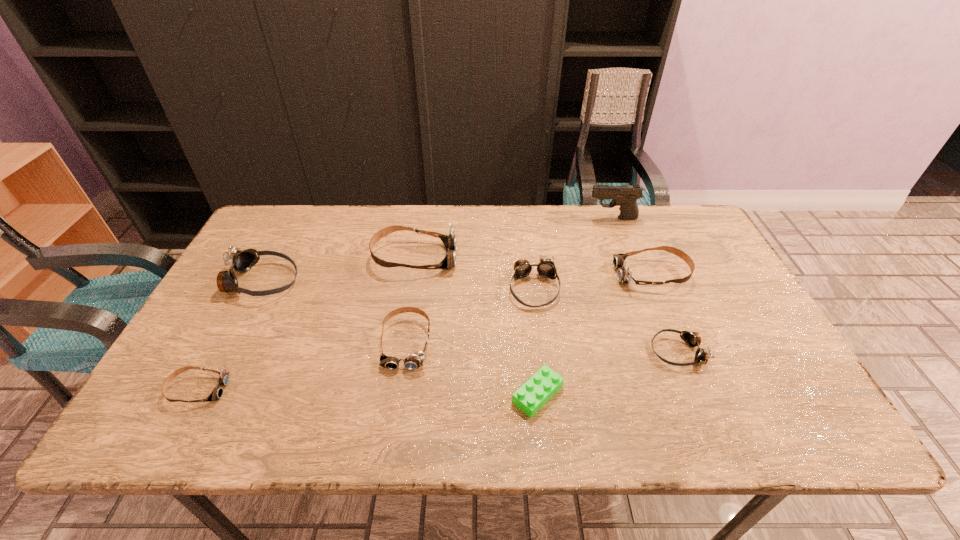
Where is `unoccupied area between the second smallest bronze goggles and the rightmost bronze goggles`? This screenshot has width=960, height=540. unoccupied area between the second smallest bronze goggles and the rightmost bronze goggles is located at coordinates (606, 320).

Image resolution: width=960 pixels, height=540 pixels. I want to click on unoccupied area between the nearest bronze goggles and the leftmost brown goggles, so click(438, 370).

Find the location of a particular element. The image size is (960, 540). free space that is in between the rightmost brown goggles and the smallest bronze goggles is located at coordinates (664, 313).

The height and width of the screenshot is (540, 960). I want to click on free spot between the green Lego and the nearest bronze goggles, so click(608, 373).

Where is `empty space that is in between the farthest object and the rightmost brown goggles`? empty space that is in between the farthest object and the rightmost brown goggles is located at coordinates (633, 246).

You are a GUI agent. You are given a task and a screenshot of the screen. Output one action in this format:
    pyautogui.click(x=<x>, y=<y>)
    Task: Click on the vacant area between the rightmost bronze goggles and the nearest brown goggles
    
    Given the screenshot: What is the action you would take?
    pyautogui.click(x=438, y=370)

Locate an element on the screen. vacant space that is in between the nearest brown goggles and the second nearest brown goggles is located at coordinates (302, 366).

Where is `free spot between the leftmost bronze goggles and the smallest brown goggles`? This screenshot has height=540, width=960. free spot between the leftmost bronze goggles and the smallest brown goggles is located at coordinates (230, 335).

You are a GUI agent. You are given a task and a screenshot of the screen. Output one action in this format:
    pyautogui.click(x=<x>, y=<y>)
    Task: Click on the object identified as the third closest to the second smallest brown goggles
    Image resolution: width=960 pixels, height=540 pixels.
    Given the screenshot: What is the action you would take?
    pyautogui.click(x=546, y=268)

Where is `object that is the second closest to the fifth goggles from left to right`? object that is the second closest to the fifth goggles from left to right is located at coordinates (624, 275).